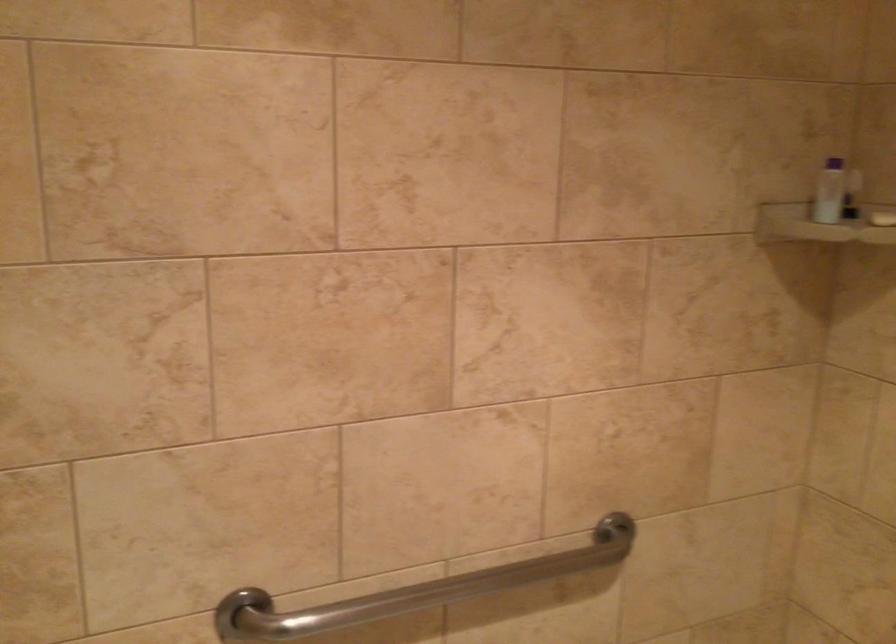
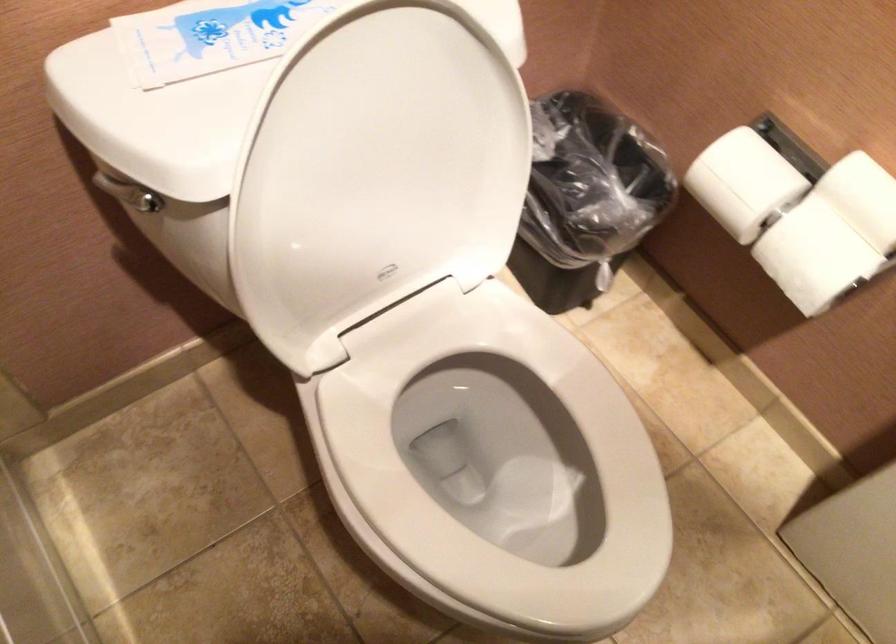
The images are taken continuously from a first-person perspective. In which direction is your viewpoint rotating?

The camera rotated toward right-down.